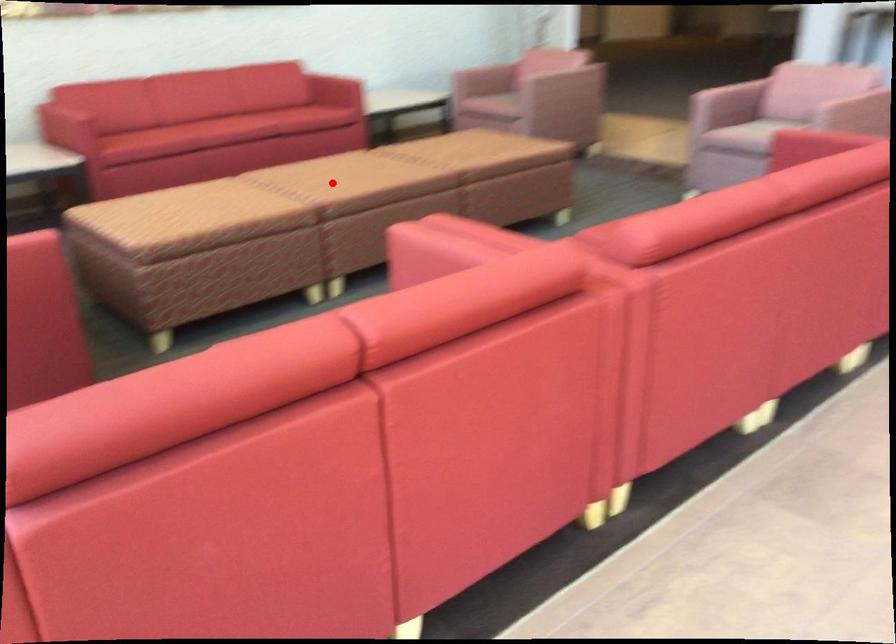
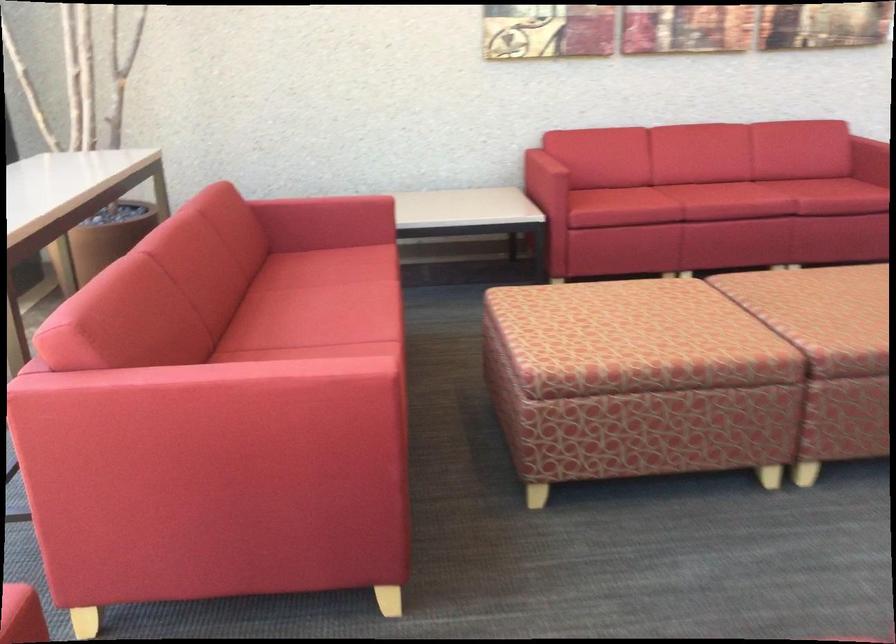
In the second image, find the point that corresponds to the highlighted location in the first image.

(834, 317)